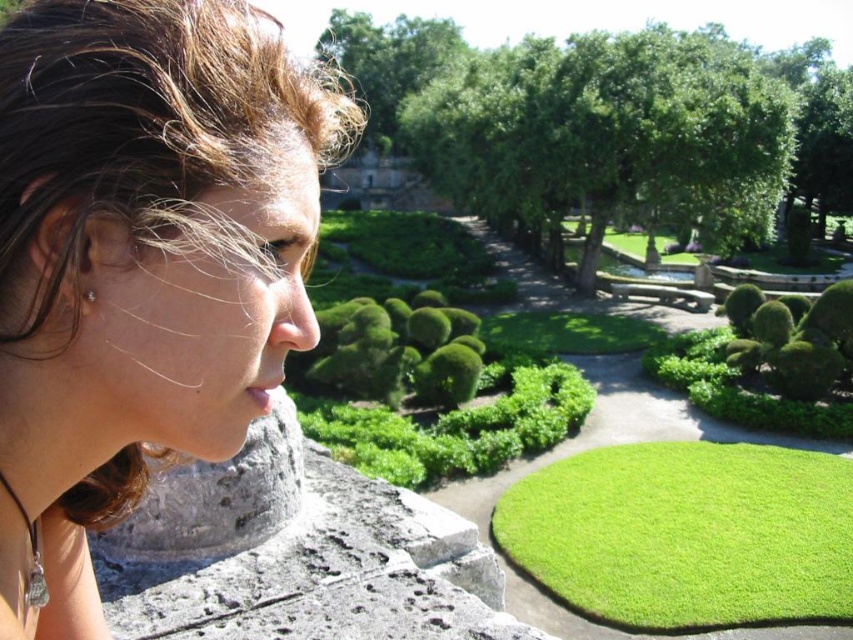
Which is below, green bushy hedge at center or silver metallic earring at left?

green bushy hedge at center is lower down.

This screenshot has height=640, width=853. In order to click on green bushy hedge at center in this screenshot , I will do `click(403, 353)`.

Where is `green bushy hedge at center`? This screenshot has height=640, width=853. green bushy hedge at center is located at coordinates (403, 353).

Is green bushy hedge at center positioned behind green leafy hedge at lower right?

No, it is not.

Who is higher up, green bushy hedge at center or green leafy hedge at lower right?

green leafy hedge at lower right

The height and width of the screenshot is (640, 853). I want to click on green bushy hedge at center, so click(403, 353).

Find the location of a particular element. The height and width of the screenshot is (640, 853). green bushy hedge at center is located at coordinates (403, 353).

Is brown hair at upper left above green bushy hedge at center?

Indeed, brown hair at upper left is positioned over green bushy hedge at center.

Where is `brown hair at upper left`? Image resolution: width=853 pixels, height=640 pixels. brown hair at upper left is located at coordinates (141, 262).